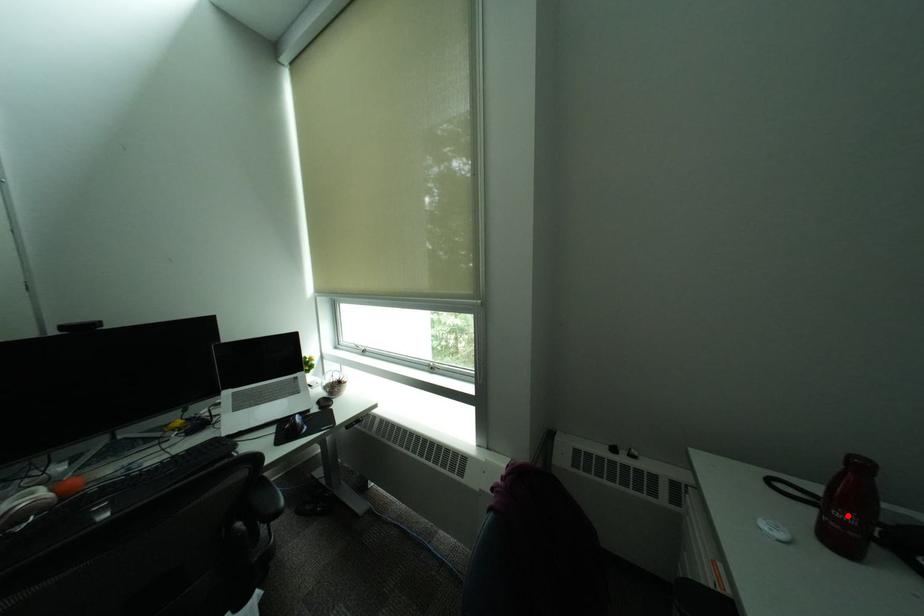
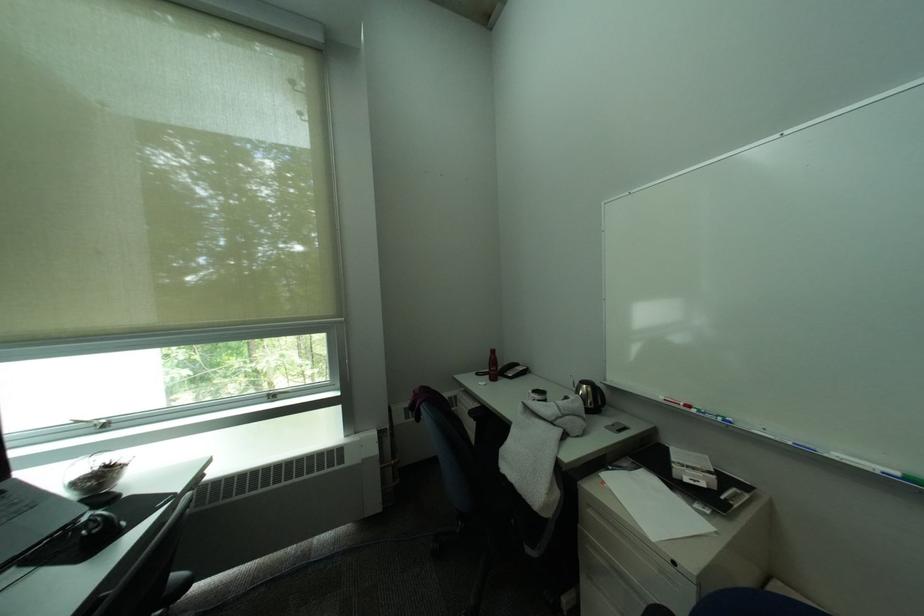
Question: A red point is marked in image1. In image2, is the corresponding 3D point closer to the camera or farther? Reply with the corresponding letter.

Choices:
 (A) The corresponding 3D point is closer.
 (B) The corresponding 3D point is farther.

Answer: (B)